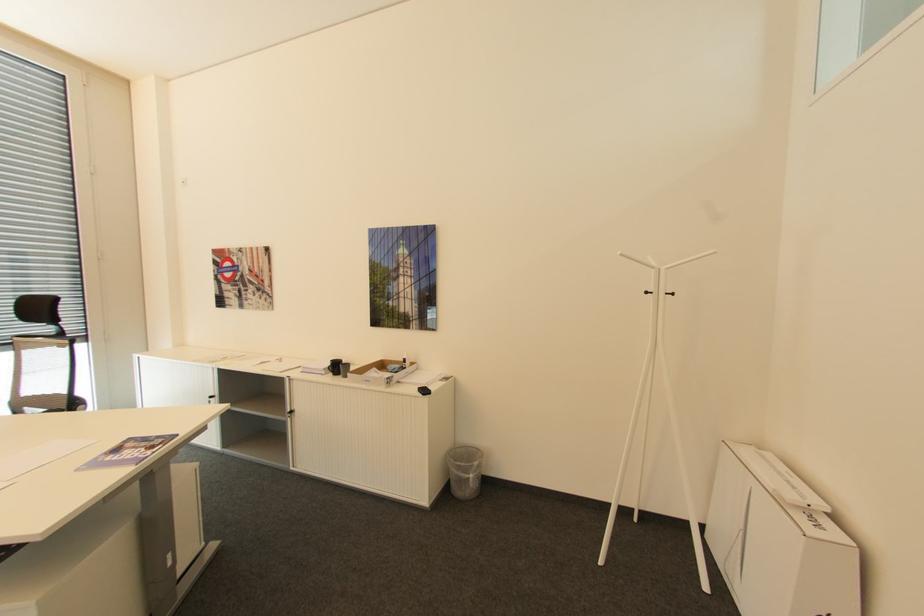
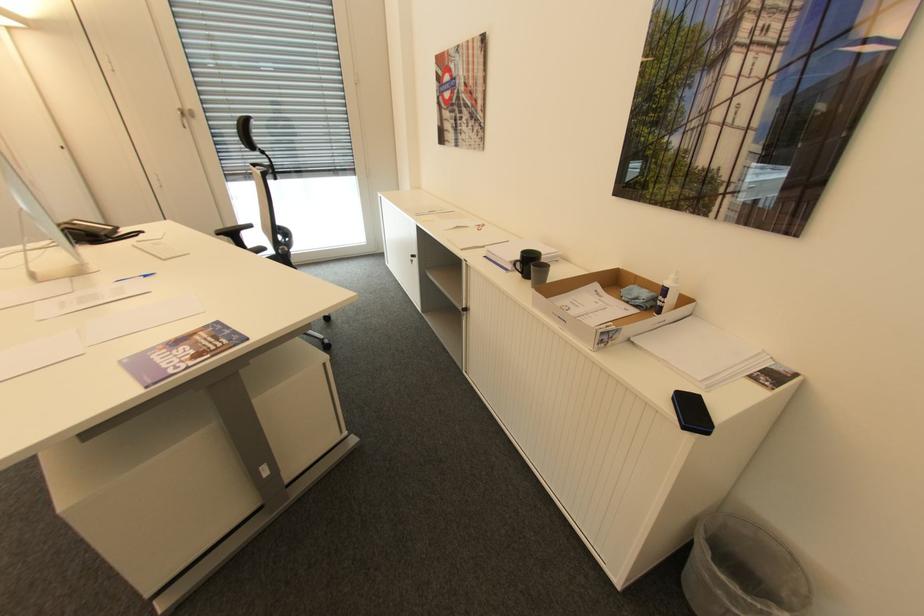
In the second image, find the point that corresponds to [392,382] in the first image.

(606, 342)